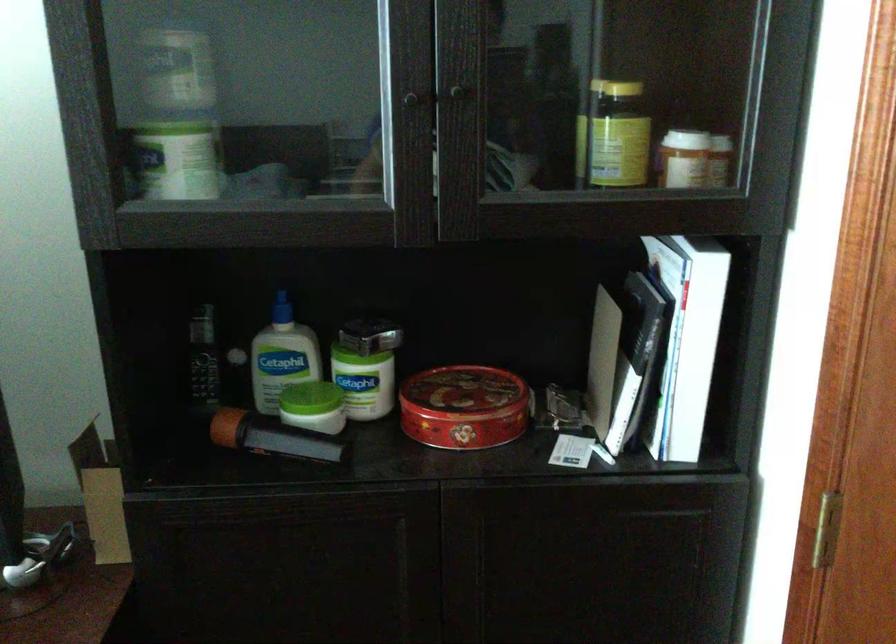
At what (x,y) coordinates should I click in order to perform the action: click on green jar lid. Please return your answer as a coordinate pair (x, y). Looking at the image, I should click on (707, 554).